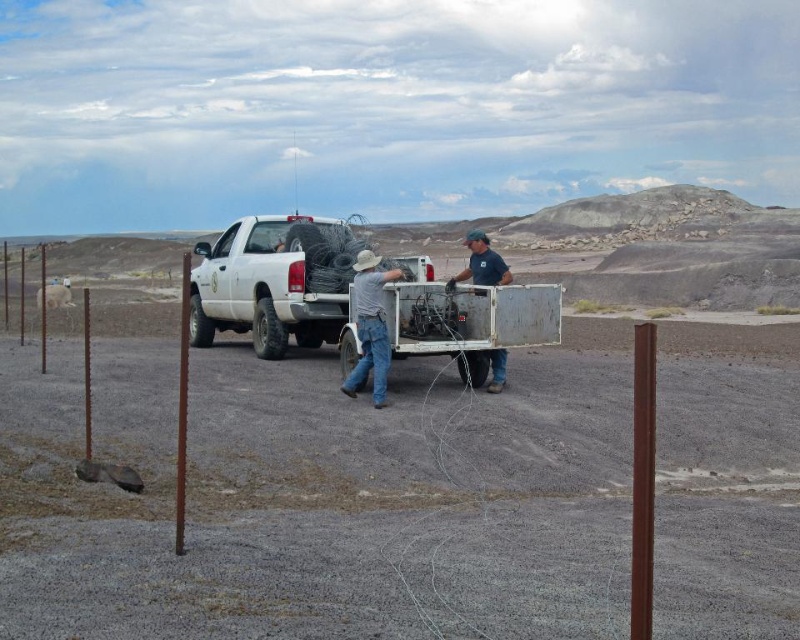
You are a hiker who has just arrived at the desert area shown in the image. You notice two items at the center of the scene. What is the position of the denim jeans at center relative to the blue fabric shirt at center?

The denim jeans at center is located below the blue fabric shirt at center.

You are a hiker who has just arrived at this desert location. You see the white matte truck at center and the denim jeans at center. Which object is closer to you?

The white matte truck at center is closer to you because it is further to the viewer than the denim jeans at center.

You are standing at the point labeled as point (370, 326) in the image. Looking around, you see the white pickup truck parked in the center. What clothing item is directly beneath your feet at this point?

The point (370, 326) is on denim jeans at center, so the clothing item directly beneath your feet at this point is denim jeans at center.